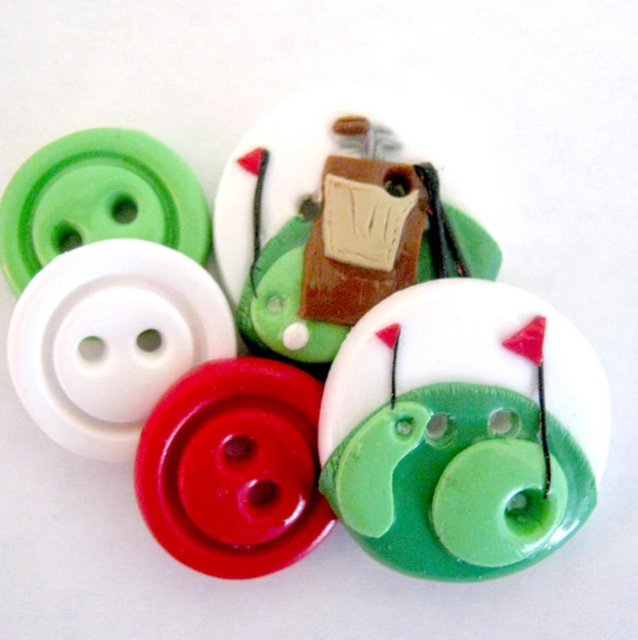
Question: Can you confirm if green glossy button at center is smaller than matte brown wooden block at center?

Choices:
 (A) no
 (B) yes

Answer: (A)

Question: Considering the relative positions of green glossy button at center and matte brown wooden block at center in the image provided, where is green glossy button at center located with respect to matte brown wooden block at center?

Choices:
 (A) below
 (B) above

Answer: (A)

Question: Which of these objects is positioned closest to the matte brown wooden block at center?

Choices:
 (A) green glossy button at center
 (B) green glossy button at upper center

Answer: (B)

Question: Which object appears closest to the camera in this image?

Choices:
 (A) matte brown wooden block at center
 (B) green glossy button at center

Answer: (B)

Question: Which point is closer to the camera?

Choices:
 (A) (549, 506)
 (B) (456, 236)

Answer: (A)

Question: Does green glossy button at center have a larger size compared to matte brown wooden block at center?

Choices:
 (A) yes
 (B) no

Answer: (A)